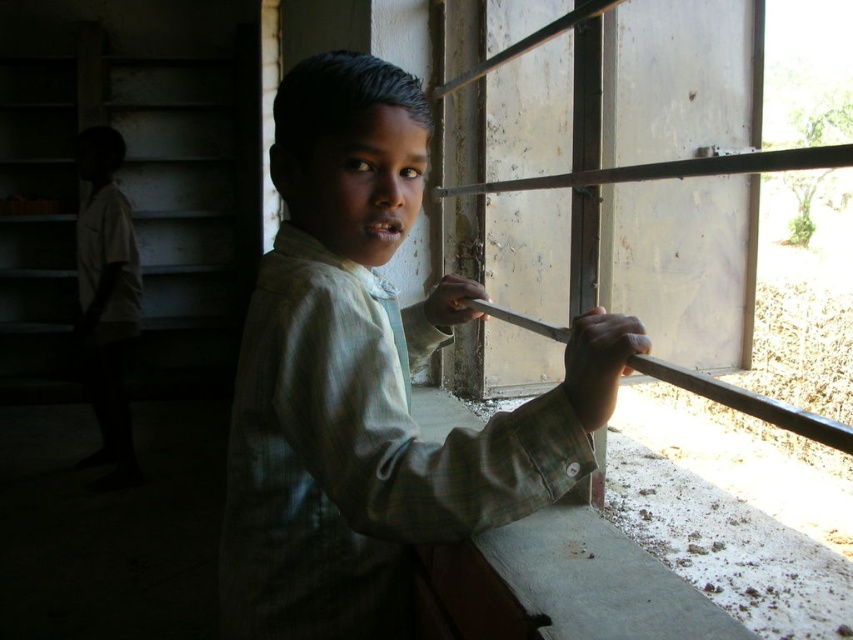
Does green plaid shirt at center have a greater width compared to metallic smooth rail at upper right?

Correct, the width of green plaid shirt at center exceeds that of metallic smooth rail at upper right.

In the scene shown: Who is positioned more to the right, green plaid shirt at center or metallic smooth rail at upper right?

metallic smooth rail at upper right

Is point (392, 518) farther from viewer compared to point (682, 381)?

No, it is not.

I want to click on green plaid shirt at center, so click(x=370, y=381).